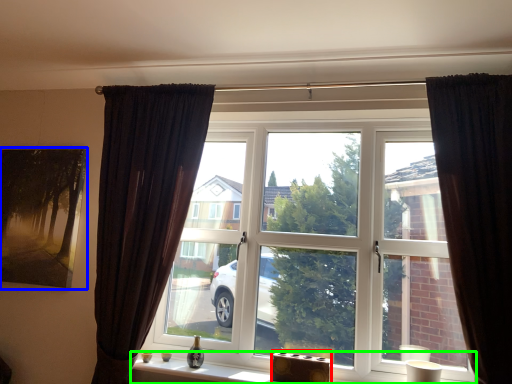
Question: Based on their relative distances, which object is nearer to furniture (highlighted by a red box)? Choose from picture frame (highlighted by a blue box) and window sill (highlighted by a green box).

Choices:
 (A) picture frame
 (B) window sill

Answer: (B)